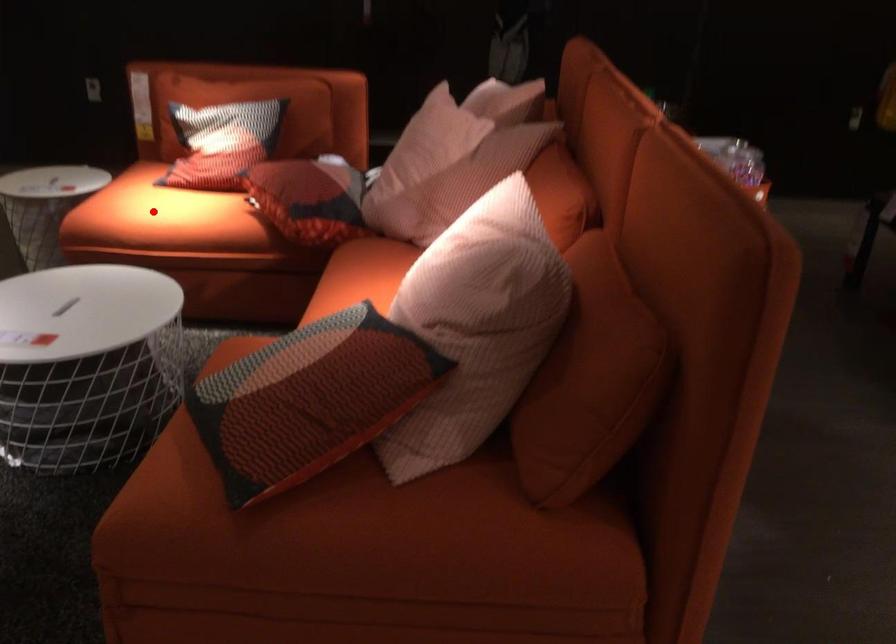
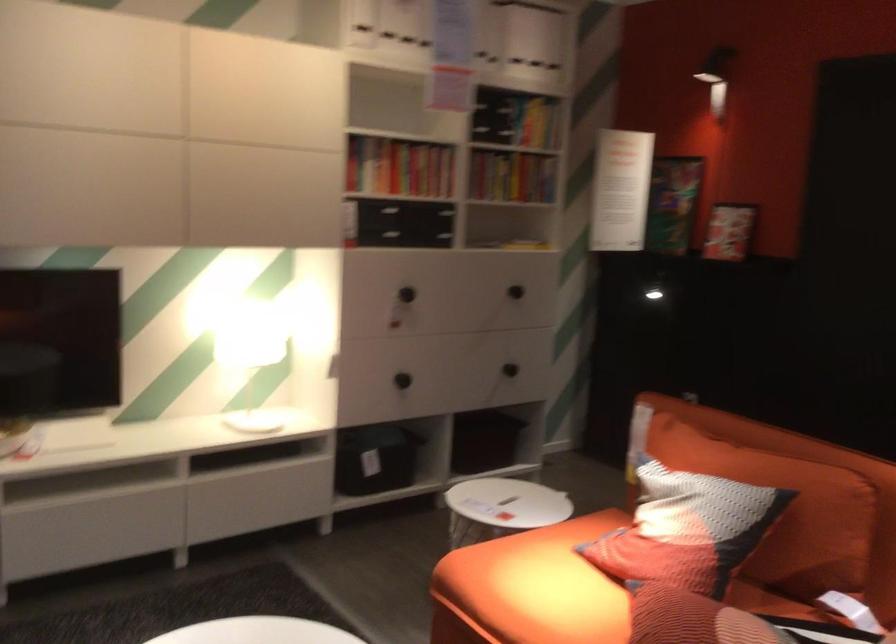
Find the pixel in the second image that matches the highlighted location in the first image.

(531, 588)